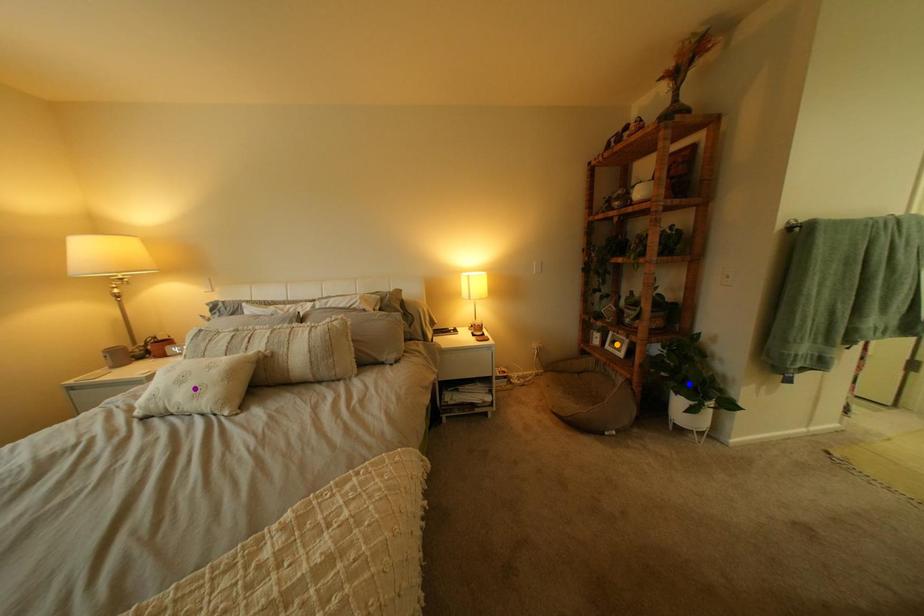
Consider the image. Order these from farthest to nearest:
purple point | orange point | blue point

orange point → blue point → purple point